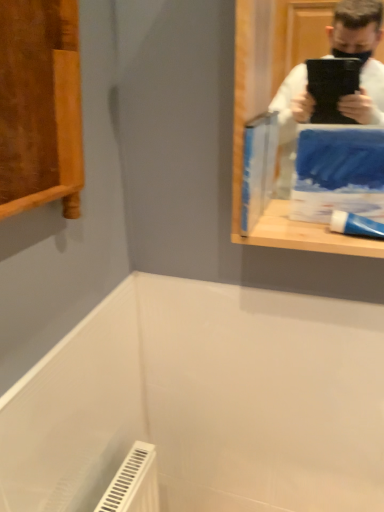
Question: Is blue matte paperback book at upper right, the second paperback book viewed from the left, aimed at white glossy toothpaste at right?

Choices:
 (A) yes
 (B) no

Answer: (A)

Question: Is blue matte paperback book at upper right, the 1th paperback book from the right, at the right side of white glossy toothpaste at right?

Choices:
 (A) yes
 (B) no

Answer: (A)

Question: Is blue matte paperback book at upper right, the second paperback book viewed from the left, taller than white glossy toothpaste at right?

Choices:
 (A) no
 (B) yes

Answer: (B)

Question: Is white glossy toothpaste at right a part of blue matte paperback book at upper right, the second paperback book viewed from the left?

Choices:
 (A) no
 (B) yes

Answer: (A)

Question: From a real-world perspective, is blue matte paperback book at upper right, the 1th paperback book from the right, below white glossy toothpaste at right?

Choices:
 (A) no
 (B) yes

Answer: (A)

Question: Can we say blue matte paperback book at upper right, the second paperback book viewed from the left, lies outside white glossy toothpaste at right?

Choices:
 (A) no
 (B) yes

Answer: (B)

Question: Is blue matte paperback book at upper right, the second paperback book viewed from the left, looking in the opposite direction of blue paper at upper right, positioned as the second paperback book in right-to-left order?

Choices:
 (A) yes
 (B) no

Answer: (B)

Question: From a real-world perspective, is blue matte paperback book at upper right, the second paperback book viewed from the left, physically below blue paper at upper right, marked as the 1th paperback book in a left-to-right arrangement?

Choices:
 (A) yes
 (B) no

Answer: (A)

Question: Considering the relative positions of blue matte paperback book at upper right, the 1th paperback book from the right, and blue paper at upper right, marked as the 1th paperback book in a left-to-right arrangement, in the image provided, is blue matte paperback book at upper right, the 1th paperback book from the right, to the right of blue paper at upper right, marked as the 1th paperback book in a left-to-right arrangement, from the viewer's perspective?

Choices:
 (A) no
 (B) yes

Answer: (B)

Question: Is blue matte paperback book at upper right, the second paperback book viewed from the left, closer to the viewer compared to blue paper at upper right, marked as the 1th paperback book in a left-to-right arrangement?

Choices:
 (A) yes
 (B) no

Answer: (A)

Question: Is blue matte paperback book at upper right, the 1th paperback book from the right, to the left of blue paper at upper right, positioned as the second paperback book in right-to-left order, from the viewer's perspective?

Choices:
 (A) yes
 (B) no

Answer: (B)

Question: Considering the relative sizes of blue matte paperback book at upper right, the 1th paperback book from the right, and blue paper at upper right, marked as the 1th paperback book in a left-to-right arrangement, in the image provided, is blue matte paperback book at upper right, the 1th paperback book from the right, wider than blue paper at upper right, marked as the 1th paperback book in a left-to-right arrangement,?

Choices:
 (A) no
 (B) yes

Answer: (B)

Question: Is the position of blue paper at upper right, marked as the 1th paperback book in a left-to-right arrangement, less distant than that of white glossy toothpaste at right?

Choices:
 (A) yes
 (B) no

Answer: (B)